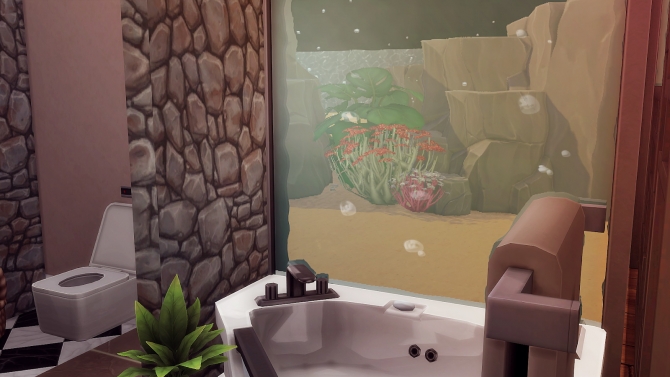
The height and width of the screenshot is (377, 670). Find the location of `green leafy plant`. green leafy plant is located at coordinates (379, 103).